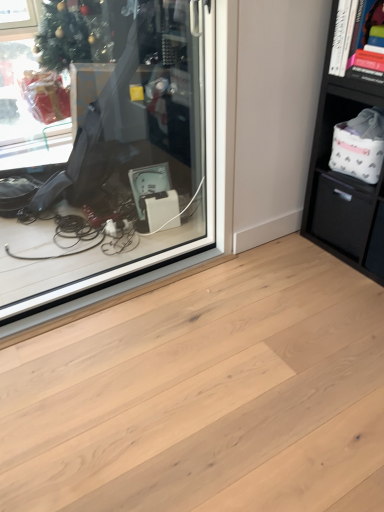
At what (x,y) coordinates should I click in order to perform the action: click on natural wood plank at center. Please return your answer as a coordinate pair (x, y). This screenshot has height=512, width=384. Looking at the image, I should click on (206, 395).

The image size is (384, 512). Find the location of `natural wood plank at center`. natural wood plank at center is located at coordinates (206, 395).

From a real-world perspective, is natural wood plank at center above or below black matte bookshelf at upper right?

In terms of real-world spatial position, natural wood plank at center is below black matte bookshelf at upper right.

Does natural wood plank at center contain black matte bookshelf at upper right?

No, natural wood plank at center does not contain black matte bookshelf at upper right.

Consider the image. Which of these two, natural wood plank at center or black matte bookshelf at upper right, is thinner?

black matte bookshelf at upper right.

How many degrees apart are the facing directions of natural wood plank at center and black matte bookshelf at upper right?

The facing directions of natural wood plank at center and black matte bookshelf at upper right are 178 degrees apart.

Can you tell me how much black matte bookshelf at upper right and transparent glass shop window at center differ in facing direction?

black matte bookshelf at upper right and transparent glass shop window at center are facing 91.6 degrees away from each other.

Is black matte bookshelf at upper right in front of or behind transparent glass shop window at center in the image?

In the image, black matte bookshelf at upper right appears behind transparent glass shop window at center.

Between point (372, 63) and point (134, 25), which one is positioned behind?

The point (134, 25) is farther from the camera.

In order to click on cabinet on the right of transparent glass shop window at center in this screenshot , I will do `click(359, 41)`.

Is natural wood plank at center turned away from black matte drawer at right?

No, natural wood plank at center is not facing the opposite direction of black matte drawer at right.

Considering the sizes of natural wood plank at center and black matte drawer at right in the image, is natural wood plank at center wider or thinner than black matte drawer at right?

Considering their sizes, natural wood plank at center looks broader than black matte drawer at right.

Is natural wood plank at center to the left or to the right of black matte drawer at right in the image?

natural wood plank at center is positioned on black matte drawer at right's left side.

Choose the correct answer: Is natural wood plank at center inside black matte drawer at right or outside it?

natural wood plank at center lies outside black matte drawer at right.

Is transparent glass shop window at center with black matte bookshelf at upper right?

No, transparent glass shop window at center is not with black matte bookshelf at upper right.

Based on their positions, is transparent glass shop window at center located to the left or right of black matte bookshelf at upper right?

Clearly, transparent glass shop window at center is on the left of black matte bookshelf at upper right in the image.

Which object is further away from the camera taking this photo, black matte drawer at right or black matte bookshelf at upper right?

black matte drawer at right is more distant.

Is black matte drawer at right taller than black matte bookshelf at upper right?

Indeed, black matte drawer at right has a greater height compared to black matte bookshelf at upper right.

Is black matte drawer at right facing towards black matte bookshelf at upper right?

No.

From a real-world perspective, between natural wood plank at center and transparent glass shop window at center, who is vertically higher?

From a 3D spatial view, transparent glass shop window at center is above.

How distant is natural wood plank at center from transparent glass shop window at center?

They are 34.60 inches apart.

Which point is more forward, (172, 398) or (12, 188)?

Positioned in front is point (172, 398).

Which of these two, natural wood plank at center or transparent glass shop window at center, is thinner?

Thinner between the two is transparent glass shop window at center.

Do you think black matte drawer at right is within transparent glass shop window at center, or outside of it?

black matte drawer at right is located beyond the bounds of transparent glass shop window at center.

From the image's perspective, which one is positioned lower, black matte drawer at right or transparent glass shop window at center?

black matte drawer at right, from the image's perspective.

Considering the sizes of objects black matte drawer at right and transparent glass shop window at center in the image provided, who is shorter, black matte drawer at right or transparent glass shop window at center?

black matte drawer at right is shorter.

There is a natural wood plank at center. Where is `cabinet above it (from a real-world perspective)`? Image resolution: width=384 pixels, height=512 pixels. cabinet above it (from a real-world perspective) is located at coordinates (359, 41).

The width and height of the screenshot is (384, 512). Identify the location of cabinet above the transparent glass shop window at center (from the image's perspective). (359, 41).

Based on their spatial positions, is black matte bookshelf at upper right or transparent glass shop window at center further from natural wood plank at center?

Among the two, black matte bookshelf at upper right is located further to natural wood plank at center.

Looking at the image, which one is located closer to black matte bookshelf at upper right, black matte drawer at right or natural wood plank at center?

black matte drawer at right.

Based on the photo, from the image, which object appears to be nearer to natural wood plank at center, transparent glass shop window at center or black matte bookshelf at upper right?

The object closer to natural wood plank at center is transparent glass shop window at center.

From the image, which object appears to be farther from black matte drawer at right, transparent glass shop window at center or natural wood plank at center?

transparent glass shop window at center.

From the picture: Based on their spatial positions, is black matte drawer at right or black matte bookshelf at upper right further from natural wood plank at center?

black matte bookshelf at upper right lies further to natural wood plank at center than the other object.

Looking at the image, which one is located further to black matte bookshelf at upper right, natural wood plank at center or transparent glass shop window at center?

Based on the image, natural wood plank at center appears to be further to black matte bookshelf at upper right.

From the picture: Considering their positions, is black matte bookshelf at upper right positioned closer to black matte drawer at right than natural wood plank at center?

The object closer to black matte drawer at right is black matte bookshelf at upper right.

Based on their spatial positions, is black matte bookshelf at upper right or black matte drawer at right closer to transparent glass shop window at center?

black matte drawer at right.

I want to click on shop window that lies between black matte bookshelf at upper right and natural wood plank at center from top to bottom, so click(116, 161).

Locate an element on the screen. cabinet located between transparent glass shop window at center and black matte drawer at right in the left-right direction is located at coordinates (359, 41).

The width and height of the screenshot is (384, 512). Find the location of `plank between transparent glass shop window at center and black matte drawer at right`. plank between transparent glass shop window at center and black matte drawer at right is located at coordinates (206, 395).

The image size is (384, 512). What are the coordinates of `drawer that lies between black matte bookshelf at upper right and natural wood plank at center from top to bottom` in the screenshot? It's located at (342, 212).